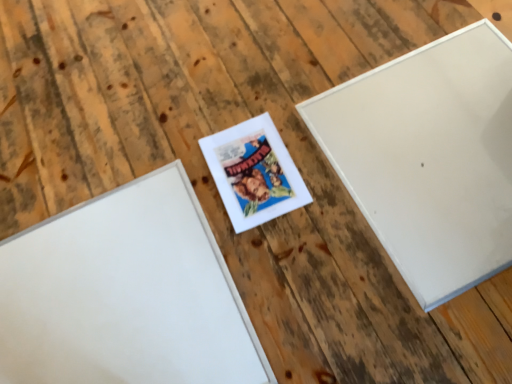
Where is `vacant region above white matte picture frame at upper right, placed as the third picture frame when sorted from left to right (from a real-world perspective)`? vacant region above white matte picture frame at upper right, placed as the third picture frame when sorted from left to right (from a real-world perspective) is located at coordinates (433, 145).